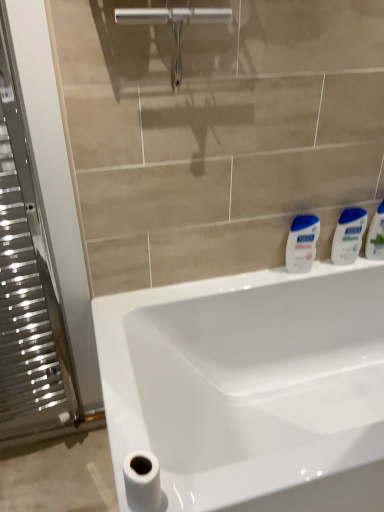
Locate an element on the screen. The width and height of the screenshot is (384, 512). vacant space behind white matte toilet paper at lower left is located at coordinates click(134, 434).